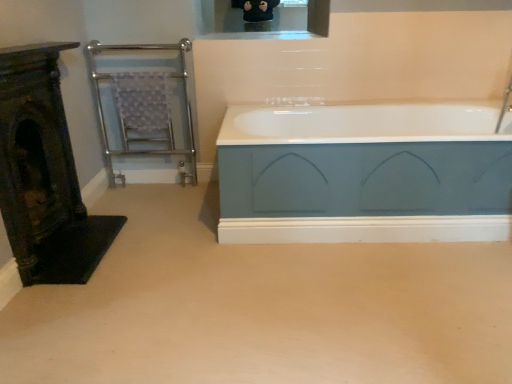
Find the location of a particular element. Image resolution: width=512 pixels, height=384 pixels. dark green ornate fireplace at left is located at coordinates (44, 174).

From the image's perspective, which one is positioned higher, dark green ornate fireplace at left or teal matte bathtub at center?

teal matte bathtub at center.

Is dark green ornate fireplace at left positioned far away from teal matte bathtub at center?

That's right, there is a large distance between dark green ornate fireplace at left and teal matte bathtub at center.

From a real-world perspective, is dark green ornate fireplace at left above or below teal matte bathtub at center?

dark green ornate fireplace at left is situated higher than teal matte bathtub at center in the real world.

Identify the location of fireplace located in front of the teal matte bathtub at center. (44, 174).

Consider the image. Is dark green ornate fireplace at left oriented towards chrome/metallic towel rail at left?

No, dark green ornate fireplace at left is not facing towards chrome/metallic towel rail at left.

From a real-world perspective, is dark green ornate fireplace at left positioned over chrome/metallic towel rail at left based on gravity?

No.

Can you tell me how much dark green ornate fireplace at left and chrome/metallic towel rail at left differ in facing direction?

The angle between the facing direction of dark green ornate fireplace at left and the facing direction of chrome/metallic towel rail at left is 89.3 degrees.

Locate an element on the screen. balustrade above the dark green ornate fireplace at left (from a real-world perspective) is located at coordinates (142, 106).

Which is behind, teal matte bathtub at center or dark green ornate fireplace at left?

teal matte bathtub at center is further from the camera.

Based on the photo, is teal matte bathtub at center aimed at dark green ornate fireplace at left?

No, teal matte bathtub at center is not oriented towards dark green ornate fireplace at left.

From a real-world perspective, between teal matte bathtub at center and dark green ornate fireplace at left, who is vertically higher?

From a 3D spatial view, dark green ornate fireplace at left is above.

Considering the points (326, 113) and (70, 281), which point is in front, point (326, 113) or point (70, 281)?

The point (70, 281) is in front.

Considering the relative sizes of chrome/metallic towel rail at left and teal matte bathtub at center in the image provided, is chrome/metallic towel rail at left taller than teal matte bathtub at center?

Yes.

Is chrome/metallic towel rail at left aimed at teal matte bathtub at center?

No, chrome/metallic towel rail at left is not turned towards teal matte bathtub at center.

Is point (90, 46) in front of point (264, 116)?

No, (90, 46) is further to viewer.

Would you say chrome/metallic towel rail at left is a long distance from dark green ornate fireplace at left?

No, chrome/metallic towel rail at left is not far away from dark green ornate fireplace at left.

Locate an element on the screen. The image size is (512, 384). balustrade that is on the right side of dark green ornate fireplace at left is located at coordinates pos(142,106).

In terms of width, does chrome/metallic towel rail at left look wider or thinner when compared to dark green ornate fireplace at left?

Considering their sizes, chrome/metallic towel rail at left looks broader than dark green ornate fireplace at left.

Between chrome/metallic towel rail at left and dark green ornate fireplace at left, which one has more height?

chrome/metallic towel rail at left.

Is point (484, 193) farther from viewer compared to point (127, 132)?

No, (484, 193) is in front of (127, 132).

Between teal matte bathtub at center and chrome/metallic towel rail at left, which one has more height?

chrome/metallic towel rail at left.

Considering the sizes of objects teal matte bathtub at center and chrome/metallic towel rail at left in the image provided, who is smaller, teal matte bathtub at center or chrome/metallic towel rail at left?

With smaller size is chrome/metallic towel rail at left.

Does teal matte bathtub at center lie behind chrome/metallic towel rail at left?

That is False.

I want to click on fireplace that appears below the teal matte bathtub at center (from the image's perspective), so click(x=44, y=174).

The height and width of the screenshot is (384, 512). In order to click on fireplace to the left of chrome/metallic towel rail at left in this screenshot , I will do [x=44, y=174].

Looking at the image, which one is located further to chrome/metallic towel rail at left, teal matte bathtub at center or dark green ornate fireplace at left?

Based on the image, teal matte bathtub at center appears to be further to chrome/metallic towel rail at left.

From the picture: Looking at the image, which one is located further to teal matte bathtub at center, dark green ornate fireplace at left or chrome/metallic towel rail at left?

Based on the image, chrome/metallic towel rail at left appears to be further to teal matte bathtub at center.

From the image, which object appears to be farther from teal matte bathtub at center, chrome/metallic towel rail at left or dark green ornate fireplace at left?

Based on the image, chrome/metallic towel rail at left appears to be further to teal matte bathtub at center.

Looking at the image, which one is located further to chrome/metallic towel rail at left, dark green ornate fireplace at left or teal matte bathtub at center?

teal matte bathtub at center.

From the picture: Looking at the image, which one is located further to dark green ornate fireplace at left, teal matte bathtub at center or chrome/metallic towel rail at left?

teal matte bathtub at center is further to dark green ornate fireplace at left.

From the image, which object appears to be farther from dark green ornate fireplace at left, chrome/metallic towel rail at left or teal matte bathtub at center?

teal matte bathtub at center lies further to dark green ornate fireplace at left than the other object.

Where is `balustrade situated between dark green ornate fireplace at left and teal matte bathtub at center from left to right`? The width and height of the screenshot is (512, 384). balustrade situated between dark green ornate fireplace at left and teal matte bathtub at center from left to right is located at coordinates (142, 106).